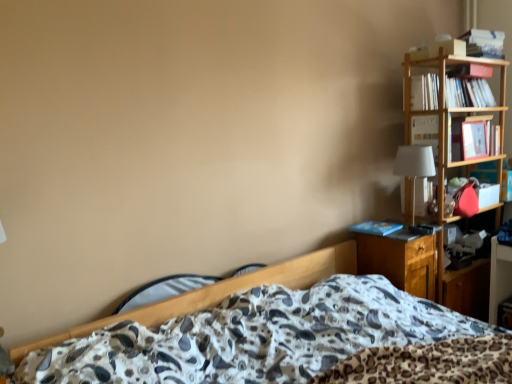
Question: Is white fabric lampshade at right behind hardcover book at upper right, the 3th book when ordered from top to bottom?

Choices:
 (A) yes
 (B) no

Answer: (B)

Question: Is white fabric lampshade at right oriented towards hardcover book at upper right, the 2th book positioned from the bottom?

Choices:
 (A) yes
 (B) no

Answer: (B)

Question: Is white fabric lampshade at right thinner than hardcover book at upper right, the 2th book positioned from the bottom?

Choices:
 (A) no
 (B) yes

Answer: (B)

Question: Is white fabric lampshade at right touching hardcover book at upper right, the 2th book positioned from the bottom?

Choices:
 (A) yes
 (B) no

Answer: (B)

Question: From the image's perspective, is white fabric lampshade at right beneath hardcover book at upper right, the 3th book when ordered from top to bottom?

Choices:
 (A) no
 (B) yes

Answer: (B)

Question: Considering their positions, is white paper book at upper right, marked as the 2th book in a top-to-bottom arrangement, located in front of or behind white fabric lampshade at right?

Choices:
 (A) behind
 (B) front

Answer: (A)

Question: From the image's perspective, relative to white fabric lampshade at right, is white paper book at upper right, marked as the 2th book in a top-to-bottom arrangement, above or below?

Choices:
 (A) above
 (B) below

Answer: (A)

Question: From their relative heights in the image, would you say white paper book at upper right, marked as the 2th book in a top-to-bottom arrangement, is taller or shorter than white fabric lampshade at right?

Choices:
 (A) tall
 (B) short

Answer: (B)

Question: Based on their positions, is white paper book at upper right, the 3th book ordered from the bottom, located to the left or right of white fabric lampshade at right?

Choices:
 (A) left
 (B) right

Answer: (B)

Question: From the image's perspective, is hardcover book at upper right, the 2th book positioned from the bottom, above or below hardcover book at upper right, the 1th book from the top?

Choices:
 (A) below
 (B) above

Answer: (A)

Question: Considering the positions of point (436, 127) and point (479, 46), is point (436, 127) closer or farther from the camera than point (479, 46)?

Choices:
 (A) farther
 (B) closer

Answer: (B)

Question: Considering the positions of hardcover book at upper right, the 2th book positioned from the bottom, and hardcover book at upper right, the 1th book from the top, in the image, is hardcover book at upper right, the 2th book positioned from the bottom, wider or thinner than hardcover book at upper right, the 1th book from the top,?

Choices:
 (A) thin
 (B) wide

Answer: (B)

Question: Considering their positions, is hardcover book at upper right, the 2th book positioned from the bottom, located in front of or behind hardcover book at upper right, which appears as the fourth book when ordered from the bottom?

Choices:
 (A) behind
 (B) front

Answer: (B)

Question: From a real-world perspective, is wooden nightstand at right above or below hardcover book at upper right, the 2th book positioned from the bottom?

Choices:
 (A) above
 (B) below

Answer: (B)

Question: Is point (403, 259) positioned closer to the camera than point (420, 115)?

Choices:
 (A) farther
 (B) closer

Answer: (B)